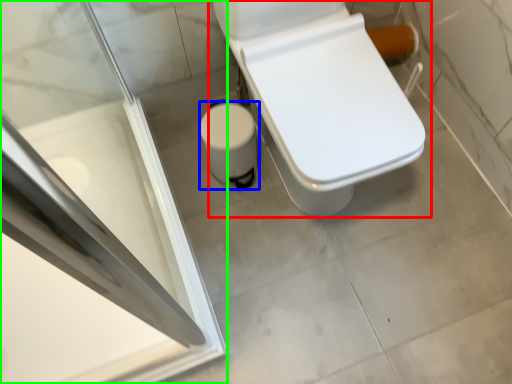
Question: Which is farther away from toilet (highlighted by a red box)? potty (highlighted by a blue box) or screen door (highlighted by a green box)?

Choices:
 (A) potty
 (B) screen door

Answer: (B)